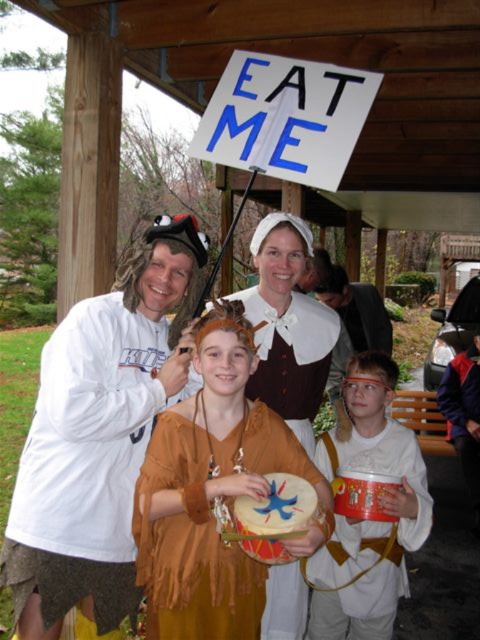
Between brown suede drum at center and orange fabric drum at center, which one has less height?

With less height is orange fabric drum at center.

Who is more distant from viewer, (x=304, y=472) or (x=288, y=515)?

The point (x=304, y=472) is behind.

The image size is (480, 640). In order to click on brown suede drum at center in this screenshot , I will do `click(207, 524)`.

Where is `matte brown dress at center`? The image size is (480, 640). matte brown dress at center is located at coordinates (288, 324).

Measure the distance from matte brown dress at center to white matte drum at center.

matte brown dress at center and white matte drum at center are 19.88 inches apart.

Where is `matte brown dress at center`? matte brown dress at center is located at coordinates (288, 324).

Locate an element on the screen. The height and width of the screenshot is (640, 480). matte brown dress at center is located at coordinates (288, 324).

How much distance is there between brown leather skirt at left and matte brown dress at center?

23.97 inches

Does brown leather skirt at left appear on the right side of matte brown dress at center?

In fact, brown leather skirt at left is to the left of matte brown dress at center.

The width and height of the screenshot is (480, 640). Find the location of `brown leather skirt at left`. brown leather skirt at left is located at coordinates (88, 433).

The image size is (480, 640). I want to click on brown leather skirt at left, so click(x=88, y=433).